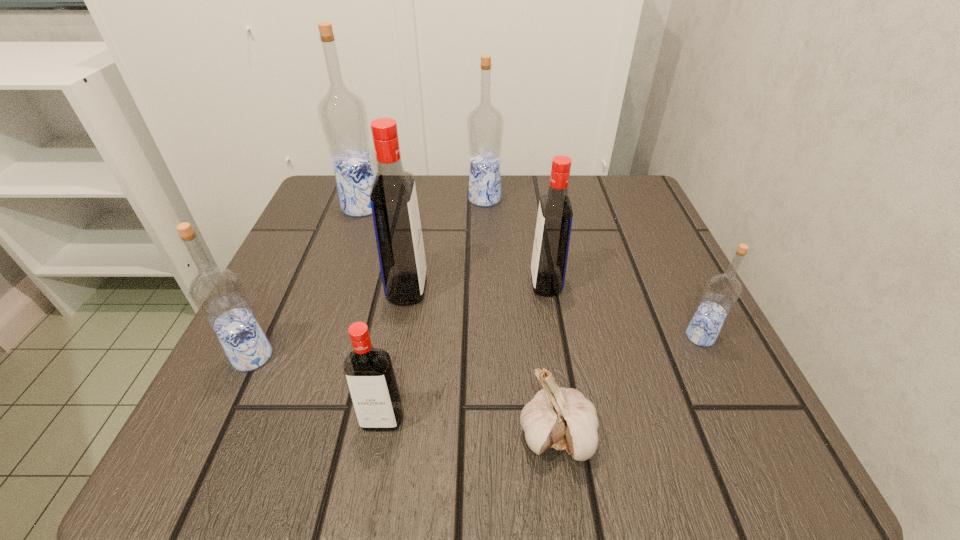
The height and width of the screenshot is (540, 960). What are the coordinates of `vacant space at the left edge` in the screenshot? It's located at (298, 317).

This screenshot has height=540, width=960. Find the location of `free space at the right edge`. free space at the right edge is located at coordinates (x=636, y=254).

In the image, there is a desktop. Identify the location of vacant space at the far left corner. Image resolution: width=960 pixels, height=540 pixels. (371, 229).

The height and width of the screenshot is (540, 960). In order to click on vacant space at the near left corner of the desktop in this screenshot , I will do `click(309, 455)`.

Locate an element on the screen. Image resolution: width=960 pixels, height=540 pixels. vacant space at the far right corner is located at coordinates (624, 225).

You are a GUI agent. You are given a task and a screenshot of the screen. Output one action in this format:
    pyautogui.click(x=<x>, y=<y>)
    Task: Click on the free space between the nearest red vodka and the second biggest blue vodka
    
    Given the screenshot: What is the action you would take?
    pyautogui.click(x=433, y=309)

This screenshot has height=540, width=960. I want to click on blank region between the sixth vodka from left to right and the fifth vodka from left to right, so click(516, 241).

Where is `free spot between the tallest vodka and the rightmost red vodka`? Image resolution: width=960 pixels, height=540 pixels. free spot between the tallest vodka and the rightmost red vodka is located at coordinates (454, 245).

Locate an element on the screen. vacant space that is in between the rightmost red vodka and the third blue vodka from right to left is located at coordinates (454, 245).

Where is `empty space that is in between the leftmost object and the third smallest blue vodka`? This screenshot has height=540, width=960. empty space that is in between the leftmost object and the third smallest blue vodka is located at coordinates (369, 278).